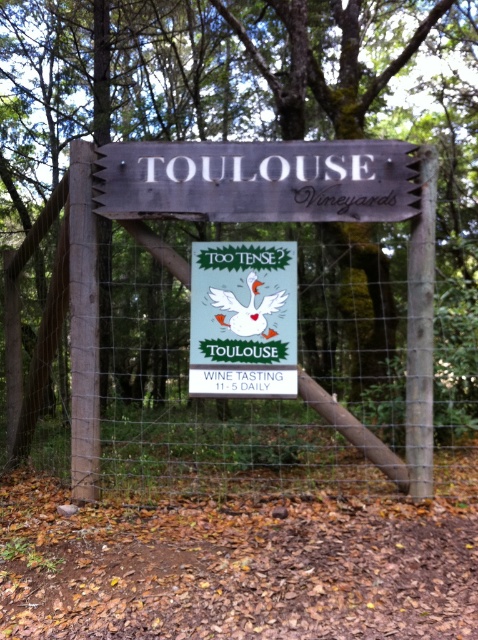
Question: Which point is closer to the camera?

Choices:
 (A) (265, 449)
 (B) (232, 336)

Answer: (B)

Question: Which object appears closest to the camera in this image?

Choices:
 (A) wooden signboard at center
 (B) wooden fence at center

Answer: (A)

Question: Does wooden fence at center have a lesser width compared to wooden signboard at center?

Choices:
 (A) yes
 (B) no

Answer: (B)

Question: Does wooden fence at center appear on the left side of matte green sign at center?

Choices:
 (A) no
 (B) yes

Answer: (B)

Question: Which object is farther from the camera taking this photo?

Choices:
 (A) matte green sign at center
 (B) wooden fence at center
 (C) wooden signboard at center

Answer: (B)

Question: Can you confirm if wooden fence at center is positioned above matte green sign at center?

Choices:
 (A) yes
 (B) no

Answer: (B)